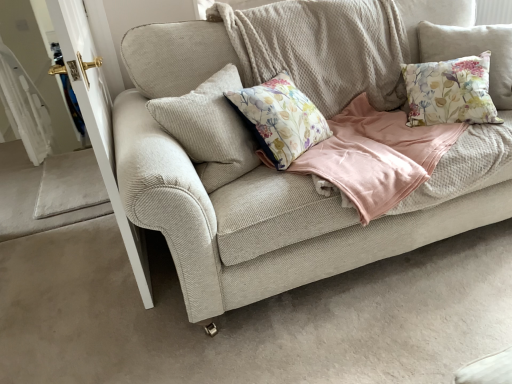
Question: Which is correct: beige corduroy couch at center is inside floral fabric cushion at upper right, acting as the first pillow starting from the right, or outside of it?

Choices:
 (A) outside
 (B) inside

Answer: (A)

Question: In the image, is beige corduroy couch at center on the left side or the right side of floral fabric cushion at upper right, which is the second pillow from left to right?

Choices:
 (A) left
 (B) right

Answer: (A)

Question: Which object is the closest to the floral fabric cushion at upper right, positioned as the 2th pillow in right-to-left order?

Choices:
 (A) white glossy door handle at left
 (B) beige corduroy couch at center
 (C) floral fabric cushion at upper right, which is the second pillow from left to right

Answer: (C)

Question: Which is nearer to the white glossy door handle at left?

Choices:
 (A) floral fabric cushion at upper right, acting as the first pillow starting from the right
 (B) beige corduroy couch at center
 (C) floral fabric cushion at upper right, positioned as the 2th pillow in right-to-left order

Answer: (B)